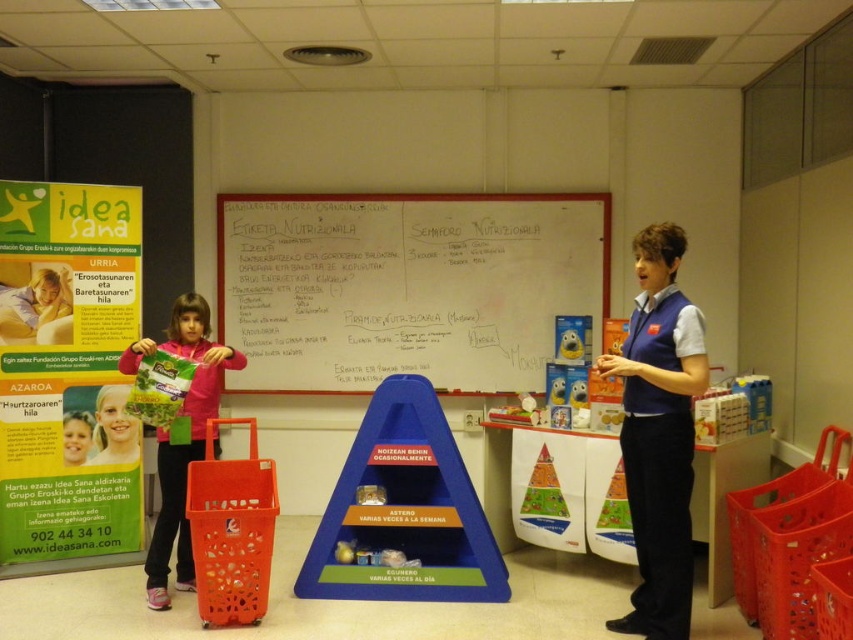
Question: Does matte pink jacket at left come in front of smooth pink sweater at left?

Choices:
 (A) no
 (B) yes

Answer: (B)

Question: Is smooth plastic bag at lower left thinner than smooth pink shirt at lower left?

Choices:
 (A) no
 (B) yes

Answer: (A)

Question: Can you confirm if blue uniform at center is wider than matte plastic toy at center?

Choices:
 (A) no
 (B) yes

Answer: (B)

Question: Which of the following is the farthest from the observer?

Choices:
 (A) blue uniform at center
 (B) smooth pink sweater at left
 (C) matte pink jacket at left
 (D) orange plastic shopping cart at lower left

Answer: (B)

Question: Estimate the real-world distances between objects in this image. Which object is closer to the orange plastic shopping cart at lower left?

Choices:
 (A) green paper poster at upper left
 (B) smooth pink shirt at lower left

Answer: (B)

Question: Which point appears farthest from the camera in this image?

Choices:
 (A) (135, 456)
 (B) (195, 424)

Answer: (A)